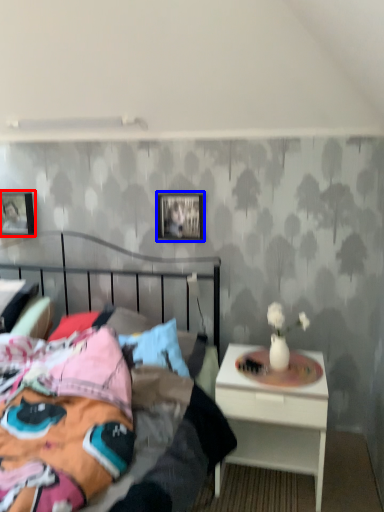
Question: Which object is further to the camera taking this photo, picture frame (highlighted by a red box) or picture frame (highlighted by a blue box)?

Choices:
 (A) picture frame
 (B) picture frame

Answer: (A)